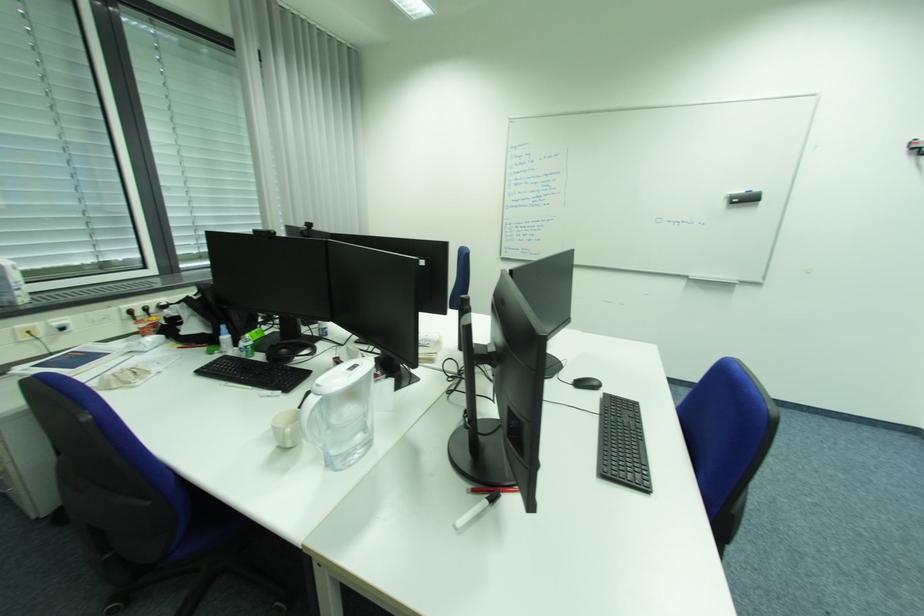
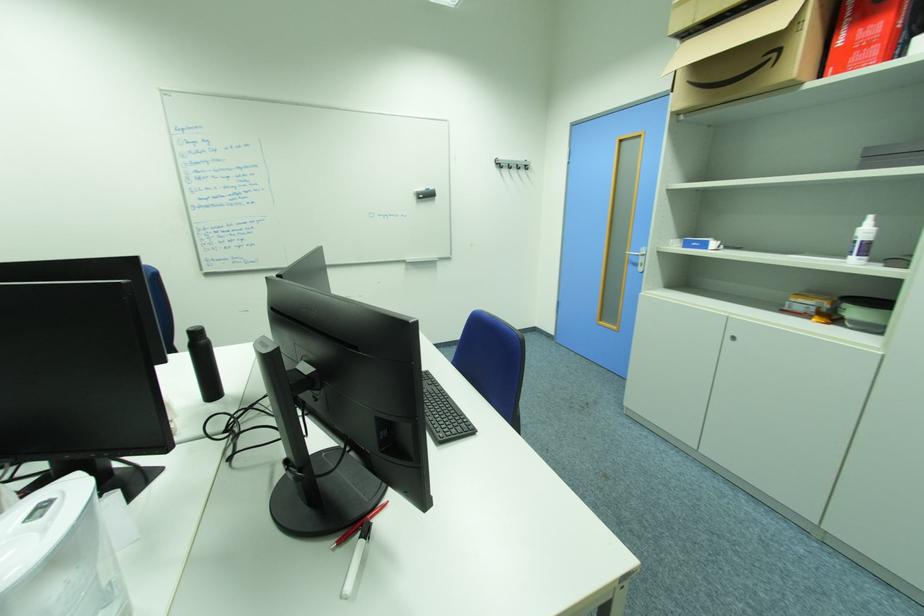
Question: The camera is either moving clockwise (left) or counter-clockwise (right) around the object. The first image is from the beginning of the video and the second image is from the end. Is the camera moving left or right when shooting the video?

Choices:
 (A) Left
 (B) Right

Answer: (A)